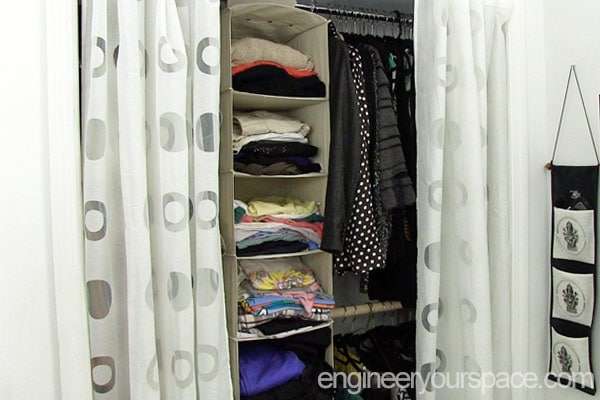
At what (x,y) coordinates should I click in order to perform the action: click on small hanging wall organizer. Please return your answer as a coordinate pair (x, y). This screenshot has width=600, height=400. Looking at the image, I should click on (578, 263).